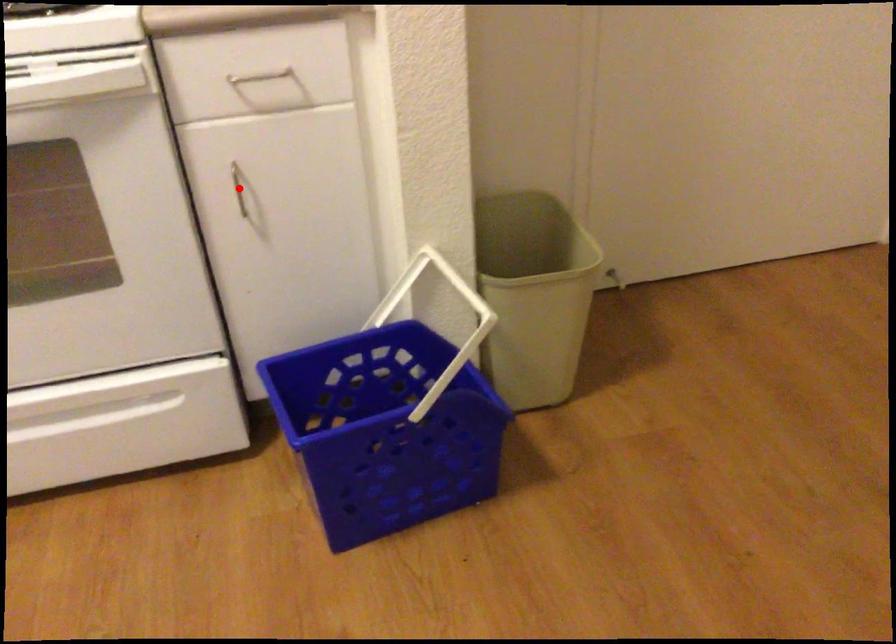
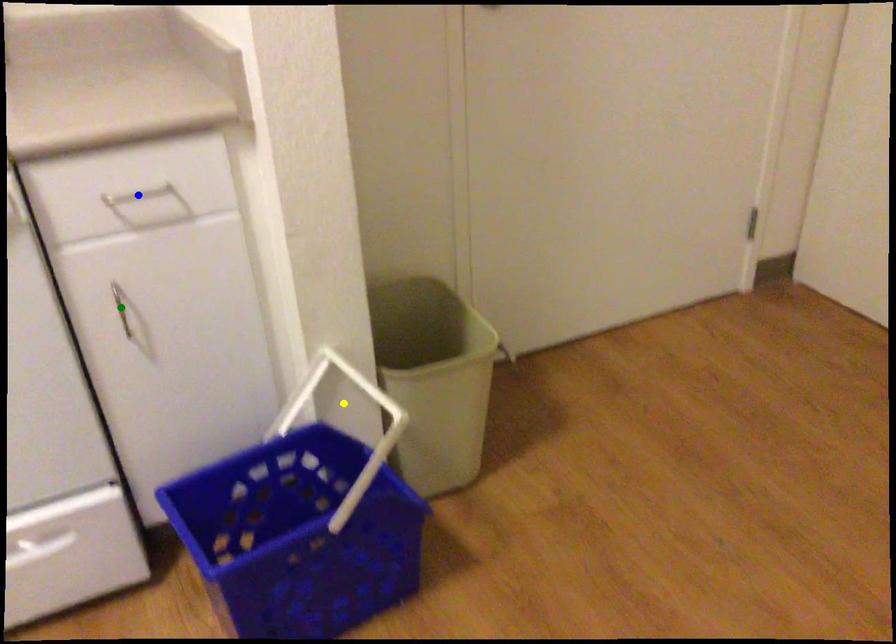
Question: I am providing you with two images of the same scene from different viewpoints. A red point is marked on the first image. You are given multiple points on the second image. Which spot in image 2 lines up with the point in image 1?

Choices:
 (A) green point
 (B) yellow point
 (C) blue point

Answer: (A)